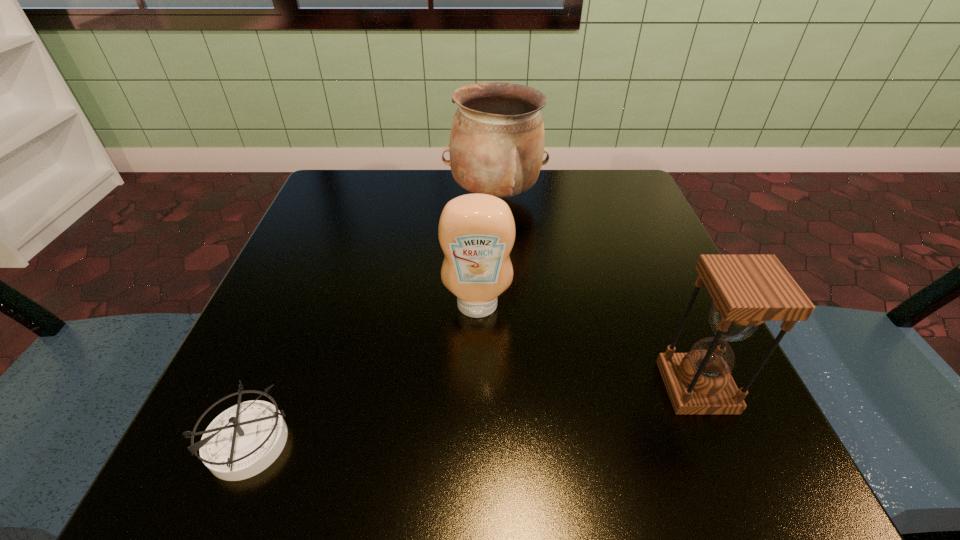
I want to click on object at the near edge, so click(245, 439).

Identify the location of object located in the left edge section of the desktop. (245, 439).

Identify the location of object that is at the right edge. The width and height of the screenshot is (960, 540). (747, 290).

At what (x,y) coordinates should I click in order to perform the action: click on object located at the near left corner. Please return your answer as a coordinate pair (x, y). Looking at the image, I should click on (245, 439).

At what (x,y) coordinates should I click in order to perform the action: click on vacant area at the near edge. Please return your answer as a coordinate pair (x, y). The image size is (960, 540). Looking at the image, I should click on (511, 465).

Where is `blank space at the left edge of the desktop`? This screenshot has height=540, width=960. blank space at the left edge of the desktop is located at coordinates (281, 278).

Identify the location of free space at the right edge of the desktop. This screenshot has width=960, height=540. (651, 308).

You are a GUI agent. You are given a task and a screenshot of the screen. Output one action in this format:
    pyautogui.click(x=<x>, y=<y>)
    Task: Click on the vacant space at the far left corner
    This screenshot has width=960, height=540.
    Given the screenshot: What is the action you would take?
    tap(373, 212)

Image resolution: width=960 pixels, height=540 pixels. In order to click on free space at the far right corner of the desktop in this screenshot , I will do `click(591, 194)`.

Where is `free space between the second farthest object and the rightmost object`? The height and width of the screenshot is (540, 960). free space between the second farthest object and the rightmost object is located at coordinates (587, 347).